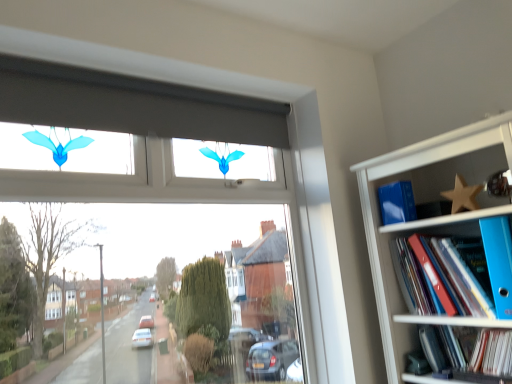
Question: Does blue matte book at upper right, which appears as the 1th paperback book when viewed from the left, have a lesser width compared to blue plastic folder at right, the 2th book in the bottom-to-top sequence?

Choices:
 (A) yes
 (B) no

Answer: (A)

Question: Can you confirm if blue matte book at upper right, which appears as the 1th paperback book when viewed from the left, is smaller than blue plastic folder at right, acting as the 1th book starting from the top?

Choices:
 (A) yes
 (B) no

Answer: (A)

Question: Can you confirm if blue matte book at upper right, which appears as the 1th paperback book when viewed from the left, is positioned to the right of blue plastic folder at right, the 2th book in the bottom-to-top sequence?

Choices:
 (A) yes
 (B) no

Answer: (B)

Question: Would you consider blue matte book at upper right, the second paperback book in the right-to-left sequence, to be distant from blue plastic folder at right, acting as the 1th book starting from the top?

Choices:
 (A) no
 (B) yes

Answer: (A)

Question: Is blue matte book at upper right, which appears as the 1th paperback book when viewed from the left, wider than blue plastic folder at right, the 2th book in the bottom-to-top sequence?

Choices:
 (A) yes
 (B) no

Answer: (B)

Question: Considering the positions of blue plastic folder at right, placed as the 2th paperback book when sorted from back to front, and blue plastic folders at upper right in the image, is blue plastic folder at right, placed as the 2th paperback book when sorted from back to front, wider or thinner than blue plastic folders at upper right?

Choices:
 (A) wide
 (B) thin

Answer: (B)

Question: In terms of height, does blue plastic folder at right, the second paperback book viewed from the left, look taller or shorter compared to blue plastic folders at upper right?

Choices:
 (A) tall
 (B) short

Answer: (B)

Question: Is blue plastic folder at right, placed as the 2th paperback book when sorted from back to front, inside the boundaries of blue plastic folders at upper right, or outside?

Choices:
 (A) outside
 (B) inside

Answer: (B)

Question: Considering the relative positions of blue plastic folder at right, placed as the 2th paperback book when sorted from back to front, and blue plastic folders at upper right in the image provided, is blue plastic folder at right, placed as the 2th paperback book when sorted from back to front, to the left or to the right of blue plastic folders at upper right?

Choices:
 (A) right
 (B) left

Answer: (A)

Question: Is wooden star at upper right taller or shorter than blue plastic folder at right, the 2th book in the bottom-to-top sequence?

Choices:
 (A) tall
 (B) short

Answer: (B)

Question: From the image's perspective, relative to blue plastic folder at right, the 2th book in the bottom-to-top sequence, is wooden star at upper right above or below?

Choices:
 (A) below
 (B) above

Answer: (B)

Question: From a real-world perspective, is wooden star at upper right positioned above or below blue plastic folder at right, acting as the 1th book starting from the top?

Choices:
 (A) above
 (B) below

Answer: (A)

Question: Do you think wooden star at upper right is within blue plastic folder at right, acting as the 1th book starting from the top, or outside of it?

Choices:
 (A) outside
 (B) inside

Answer: (A)

Question: Is blue plastic folder at lower right, which is the 1th book in bottom-to-top order, wider or thinner than blue plastic folder at right, placed as the 2th paperback book when sorted from back to front?

Choices:
 (A) wide
 (B) thin

Answer: (A)

Question: From a real-world perspective, relative to blue plastic folder at right, placed as the first paperback book when sorted from right to left, is blue plastic folder at lower right, which is counted as the 2th book, starting from the top, vertically above or below?

Choices:
 (A) above
 (B) below

Answer: (B)